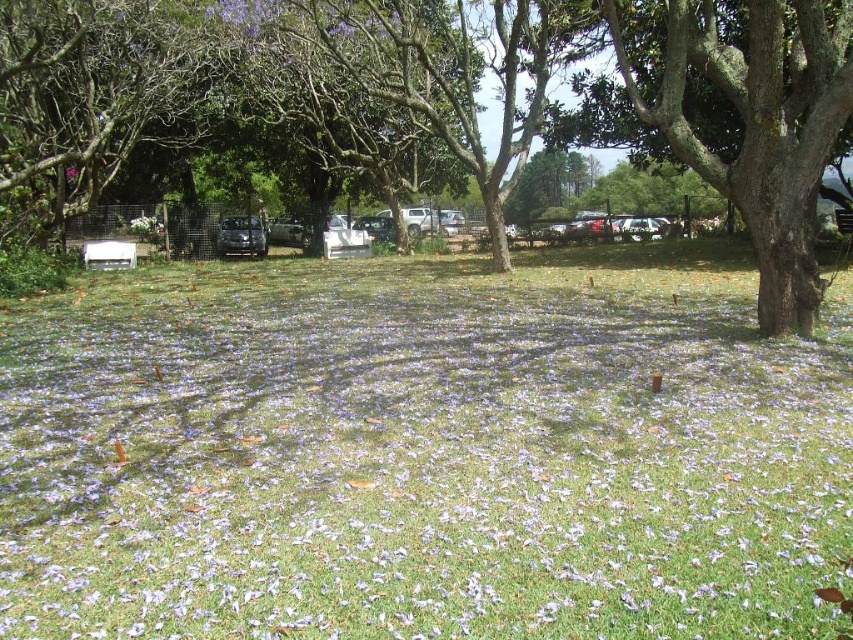
You are a gardener planning to plant a new row of flowers in the park. You notice the purple grass at center and the green leafy tree at center. Which of these two has a wider spread in terms of their coverage area?

The green leafy tree at center has a wider spread than the purple grass at center, as the purple grass at center is narrower in width compared to the green leafy tree at center.

You are standing at the center of the grassy field and see the point labeled as point (422,452). What color is the grass at that specific point?

The grass at point (422,452) is purple because the point indicates purple grass at center.